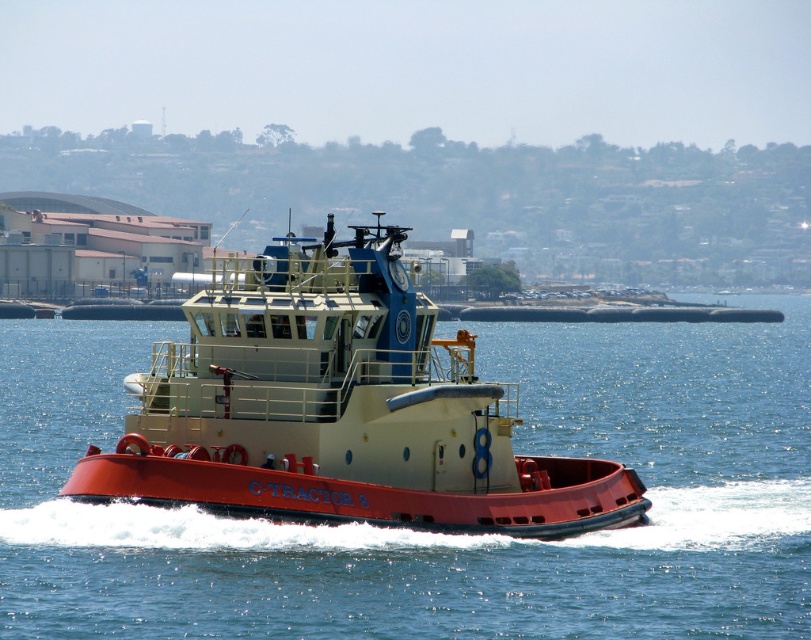
Question: Is red matte water at center above red matte tugboat at center?

Choices:
 (A) yes
 (B) no

Answer: (A)

Question: Is red matte water at center above red matte tugboat at center?

Choices:
 (A) yes
 (B) no

Answer: (A)

Question: Which point is farther from the camera taking this photo?

Choices:
 (A) (222, 378)
 (B) (767, 611)

Answer: (A)

Question: Does red matte water at center appear on the right side of red matte tugboat at center?

Choices:
 (A) yes
 (B) no

Answer: (B)

Question: Which of the following is the farthest from the observer?

Choices:
 (A) (309, 410)
 (B) (116, 396)

Answer: (B)